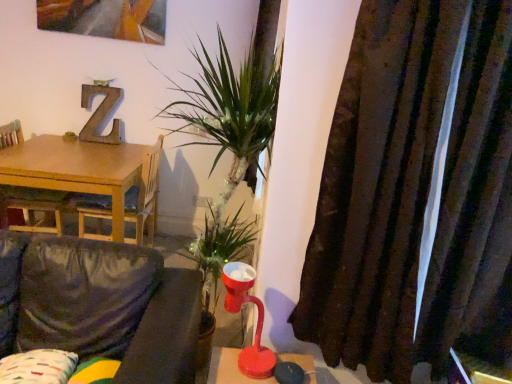
The image size is (512, 384). What do you see at coordinates (257, 319) in the screenshot? I see `matte red table lamp at center` at bounding box center [257, 319].

What do you see at coordinates (101, 305) in the screenshot? This screenshot has width=512, height=384. I see `velvet dark grey couch at lower left` at bounding box center [101, 305].

The width and height of the screenshot is (512, 384). Describe the element at coordinates (144, 197) in the screenshot. I see `light brown wood chair at left, the second chair from the left` at that location.

Find the location of `wooden chair at left, the 1th chair from the left`. wooden chair at left, the 1th chair from the left is located at coordinates (32, 207).

Find the location of a particular element. This screenshot has width=512, height=384. patterned fabric pillow at lower left is located at coordinates pos(38,367).

Identify the location of matte red table lamp at center. The width and height of the screenshot is (512, 384). (257, 319).

From a real-world perspective, which object stands above the other?

brown textured curtain at right.

Considering the points (24, 382) and (487, 102), which point is in front, point (24, 382) or point (487, 102)?

The point (487, 102) is closer to the camera.

From the image's perspective, between patterned fabric pillow at lower left and brown textured curtain at right, who is located below?

patterned fabric pillow at lower left appears lower in the image.

Considering the sizes of objects velvet dark grey couch at lower left and wooden chair at left, the 1th chair from the left, in the image provided, who is bigger, velvet dark grey couch at lower left or wooden chair at left, the 1th chair from the left,?

With larger size is velvet dark grey couch at lower left.

Considering their positions, is velvet dark grey couch at lower left located in front of or behind wooden chair at left, the 1th chair from the left?

velvet dark grey couch at lower left is positioned closer to the viewer than wooden chair at left, the 1th chair from the left.

Would you say velvet dark grey couch at lower left is a long distance from wooden chair at left, placed as the second chair when sorted from right to left?

Yes, velvet dark grey couch at lower left and wooden chair at left, placed as the second chair when sorted from right to left, are quite far apart.

Between point (169, 275) and point (26, 212), which one is positioned in front?

Positioned in front is point (169, 275).

Between matte red table lamp at center and wooden chair at left, placed as the second chair when sorted from right to left, which one is positioned in front?

Positioned in front is matte red table lamp at center.

Is matte red table lamp at center surrounding wooden chair at left, the 1th chair from the left?

Actually, wooden chair at left, the 1th chair from the left, is outside matte red table lamp at center.

From a real-world perspective, is matte red table lamp at center physically located above or below wooden chair at left, placed as the second chair when sorted from right to left?

Clearly, from a real-world perspective, matte red table lamp at center is above wooden chair at left, placed as the second chair when sorted from right to left.

Is matte red table lamp at center not near wooden chair at left, placed as the second chair when sorted from right to left?

Yes.

Is light brown wood chair at left, the second chair from the left, to the left of brown textured curtain at right from the viewer's perspective?

Yes, light brown wood chair at left, the second chair from the left, is to the left of brown textured curtain at right.

From a real-world perspective, is light brown wood chair at left, the second chair from the left, beneath brown textured curtain at right?

Yes, from a real-world perspective, light brown wood chair at left, the second chair from the left, is under brown textured curtain at right.

Is there a large distance between light brown wood chair at left, the second chair from the left, and brown textured curtain at right?

Yes.

Is light brown wood chair at left, marked as the 1th chair in a right-to-left arrangement, positioned beyond the bounds of brown textured curtain at right?

Yes, light brown wood chair at left, marked as the 1th chair in a right-to-left arrangement, is not within brown textured curtain at right.

From a real-world perspective, is patterned fabric pillow at lower left physically above light brown wood chair at left, the second chair from the left?

Indeed, from a real-world perspective, patterned fabric pillow at lower left stands above light brown wood chair at left, the second chair from the left.

Does patterned fabric pillow at lower left contain light brown wood chair at left, marked as the 1th chair in a right-to-left arrangement?

Actually, light brown wood chair at left, marked as the 1th chair in a right-to-left arrangement, is outside patterned fabric pillow at lower left.

Is patterned fabric pillow at lower left oriented away from light brown wood chair at left, marked as the 1th chair in a right-to-left arrangement?

patterned fabric pillow at lower left does not have its back to light brown wood chair at left, marked as the 1th chair in a right-to-left arrangement.

Is patterned fabric pillow at lower left wider or thinner than light brown wood chair at left, marked as the 1th chair in a right-to-left arrangement?

In the image, patterned fabric pillow at lower left appears to be more narrow than light brown wood chair at left, marked as the 1th chair in a right-to-left arrangement.

Is wooden table at left taller than brown textured curtain at right?

No.

In the image, is wooden table at left positioned in front of or behind brown textured curtain at right?

Result: wooden table at left is positioned farther from the viewer than brown textured curtain at right.

In the scene shown: Is wooden table at left far away from brown textured curtain at right?

Indeed, wooden table at left is not near brown textured curtain at right.

Considering the relative sizes of brown textured curtain at right and wooden table at left in the image provided, is brown textured curtain at right thinner than wooden table at left?

Yes.

Considering the positions of points (499, 278) and (25, 142), is point (499, 278) farther from camera compared to point (25, 142)?

No, (499, 278) is closer to viewer.

Does brown textured curtain at right contain wooden table at left?

No, wooden table at left is not surrounded by brown textured curtain at right.

There is a patterned fabric pillow at lower left. Identify the location of curtain above it (from a real-world perspective). The image size is (512, 384). (415, 194).

Where is `studio couch that is below the wooden chair at left, the 1th chair from the left (from the image's perspective)`? This screenshot has height=384, width=512. studio couch that is below the wooden chair at left, the 1th chair from the left (from the image's perspective) is located at coordinates (101, 305).

Which object lies nearer to the anchor point light brown wood chair at left, the second chair from the left, patterned fabric pillow at lower left or wooden table at left?

wooden table at left is closer to light brown wood chair at left, the second chair from the left.

Which object lies nearer to the anchor point patterned fabric pillow at lower left, light brown wood chair at left, marked as the 1th chair in a right-to-left arrangement, or wooden table at left?

Based on the image, wooden table at left appears to be nearer to patterned fabric pillow at lower left.

Estimate the real-world distances between objects in this image. Which object is closer to patterned fabric pillow at lower left, matte red table lamp at center or brown textured curtain at right?

Based on the image, matte red table lamp at center appears to be nearer to patterned fabric pillow at lower left.

Based on their spatial positions, is patterned fabric pillow at lower left or brown textured curtain at right further from matte red table lamp at center?

Based on the image, patterned fabric pillow at lower left appears to be further to matte red table lamp at center.

Based on the photo, considering their positions, is patterned fabric pillow at lower left positioned further to brown textured curtain at right than matte red table lamp at center?

patterned fabric pillow at lower left is positioned further to the anchor brown textured curtain at right.

From the image, which object appears to be nearer to matte red table lamp at center, wooden chair at left, the 1th chair from the left, or velvet dark grey couch at lower left?

velvet dark grey couch at lower left is closer to matte red table lamp at center.

Which object lies nearer to the anchor point wooden chair at left, the 1th chair from the left, velvet dark grey couch at lower left or matte red table lamp at center?

Based on the image, velvet dark grey couch at lower left appears to be nearer to wooden chair at left, the 1th chair from the left.

Which object lies further to the anchor point wooden table at left, wooden chair at left, placed as the second chair when sorted from right to left, or matte red table lamp at center?

matte red table lamp at center is further to wooden table at left.

You are a GUI agent. You are given a task and a screenshot of the screen. Output one action in this format:
    pyautogui.click(x=<x>, y=<y>)
    Task: Click on the table between patterned fabric pillow at lower left and light brown wood chair at left, marked as the 1th chair in a right-to-left arrangement, in the front-back direction
    The height and width of the screenshot is (384, 512).
    Given the screenshot: What is the action you would take?
    pyautogui.click(x=85, y=170)

Locate an element on the screen. The height and width of the screenshot is (384, 512). table between wooden chair at left, the 1th chair from the left, and light brown wood chair at left, marked as the 1th chair in a right-to-left arrangement, from left to right is located at coordinates [85, 170].

Find the location of a particular element. The height and width of the screenshot is (384, 512). studio couch located between wooden table at left and brown textured curtain at right in the left-right direction is located at coordinates (101, 305).

The width and height of the screenshot is (512, 384). I want to click on chair between wooden table at left and brown textured curtain at right, so click(144, 197).